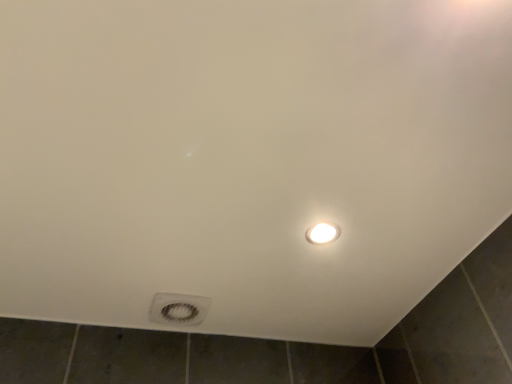
Describe the element at coordinates (178, 309) in the screenshot. I see `white plastic hole at lower center` at that location.

Where is `white plastic hole at lower center`? This screenshot has height=384, width=512. white plastic hole at lower center is located at coordinates (178, 309).

Looking at this image, what is the approximate height of white plastic hole at lower center?

white plastic hole at lower center is 1.12 inches in height.

At what (x,y) coordinates should I click in order to perform the action: click on white plastic hole at lower center. Please return your answer as a coordinate pair (x, y). The image size is (512, 384). Looking at the image, I should click on tap(178, 309).